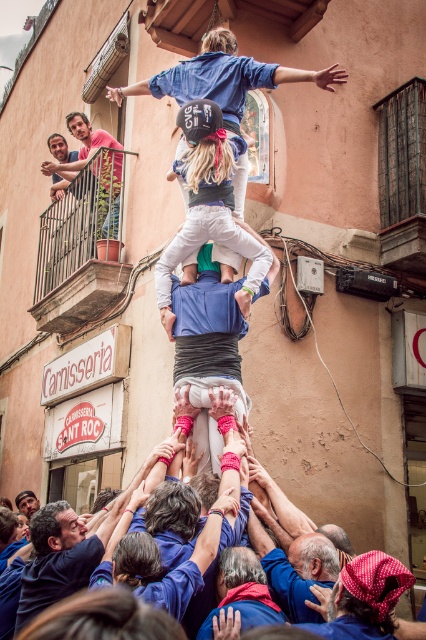
Can you confirm if blue fabric shirt at center is positioned below blue fabric hands at center?

Actually, blue fabric shirt at center is above blue fabric hands at center.

Can you confirm if blue fabric shirt at center is positioned to the left of blue fabric hands at center?

No, blue fabric shirt at center is not to the left of blue fabric hands at center.

What do you see at coordinates (207, 348) in the screenshot? Image resolution: width=426 pixels, height=640 pixels. I see `blue fabric shirt at center` at bounding box center [207, 348].

Where is `blue fabric shirt at center`? This screenshot has height=640, width=426. blue fabric shirt at center is located at coordinates (207, 348).

Which is below, light blue denim pants at center or light brown wooden railing at upper left?

light blue denim pants at center is lower down.

Describe the element at coordinates (207, 204) in the screenshot. I see `light blue denim pants at center` at that location.

Is point (198, 240) farther from viewer compared to point (43, 163)?

No, it is in front of (43, 163).

The width and height of the screenshot is (426, 640). Find the location of `light blue denim pants at center`. light blue denim pants at center is located at coordinates (207, 204).

Who is more forward, (x=206, y=209) or (x=227, y=352)?

Point (x=227, y=352) is more forward.

At what (x,y) coordinates should I click in order to perform the action: click on light blue denim pants at center. Please return your answer as a coordinate pair (x, y). Looking at the image, I should click on (207, 204).

Is point (244, 237) closer to camera compared to point (212, 346)?

No, it is not.

You are a GUI agent. You are given a task and a screenshot of the screen. Output one action in this format:
    pyautogui.click(x=<x>, y=<y>)
    Task: Click on the light blue denim pants at center
    
    Given the screenshot: What is the action you would take?
    pyautogui.click(x=207, y=204)